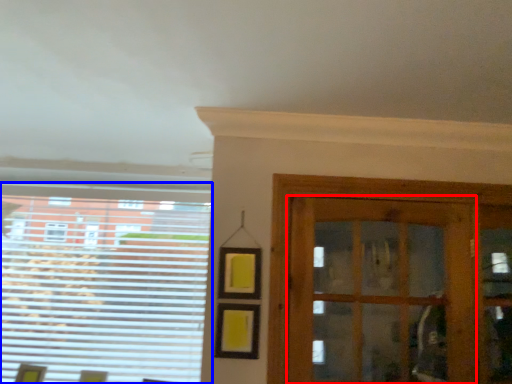
Question: Which object is further to the camera taking this photo, door (highlighted by a red box) or window (highlighted by a blue box)?

Choices:
 (A) door
 (B) window

Answer: (B)